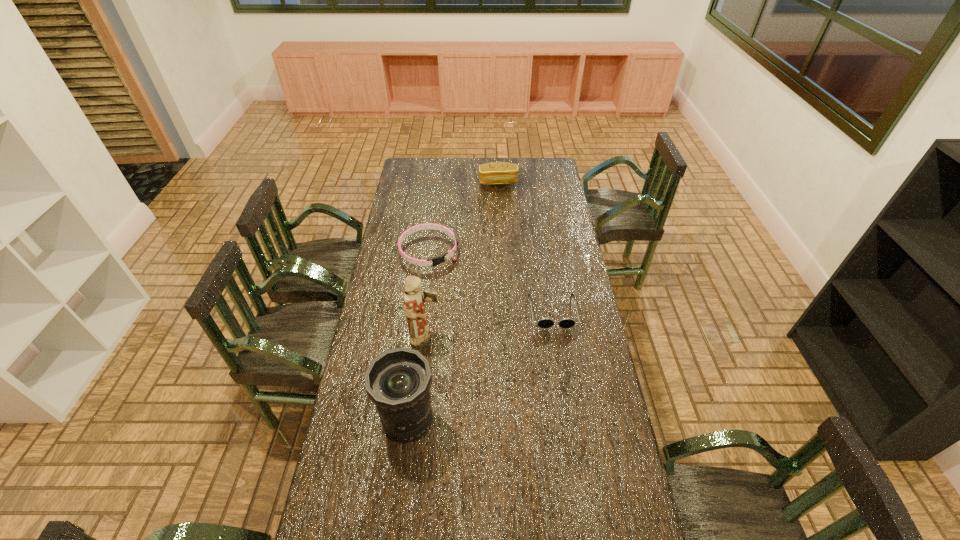
Locate an element on the screen. dog collar that is at the left edge is located at coordinates (438, 260).

I want to click on object located in the right edge section of the desktop, so click(544, 322).

Image resolution: width=960 pixels, height=540 pixels. What are the coordinates of `free space at the far edge` in the screenshot? It's located at (526, 159).

The height and width of the screenshot is (540, 960). In order to click on free space at the left edge of the desktop in this screenshot , I will do `click(362, 404)`.

Locate an element on the screen. vacant space at the right edge is located at coordinates (561, 215).

You are a GUI agent. You are given a task and a screenshot of the screen. Output one action in this format:
    pyautogui.click(x=<x>, y=<y>)
    Task: Click on the vacant area at the near right corner
    The height and width of the screenshot is (540, 960).
    Given the screenshot: What is the action you would take?
    pyautogui.click(x=600, y=504)

This screenshot has width=960, height=540. Identify the location of vacant space that's between the sunglasses and the dog collar. (491, 281).

Find the location of a particular element. free point between the sunglasses and the fourth nearest object is located at coordinates (491, 281).

At what (x,y) coordinates should I click in order to perform the action: click on free space between the dog collar and the clutch bag. Please return your answer as a coordinate pair (x, y). Looking at the image, I should click on (464, 217).

Where is `vacant region between the sunglasses and the tallest object`? The height and width of the screenshot is (540, 960). vacant region between the sunglasses and the tallest object is located at coordinates (490, 325).